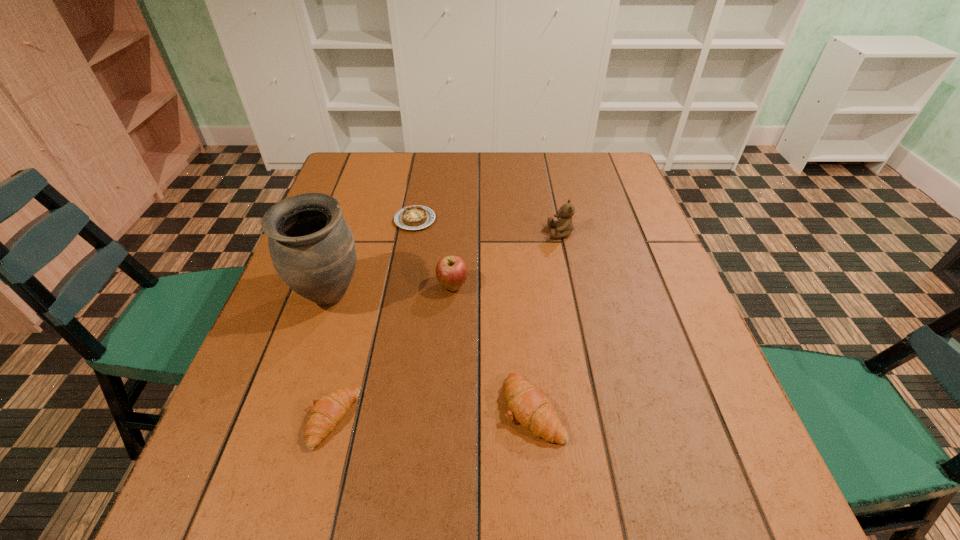
What are the coordinates of `vacant space that satisfies the following two spatial constraints: 1. on the front side of the third shortest object; 2. on the left side of the apple` in the screenshot? It's located at (445, 409).